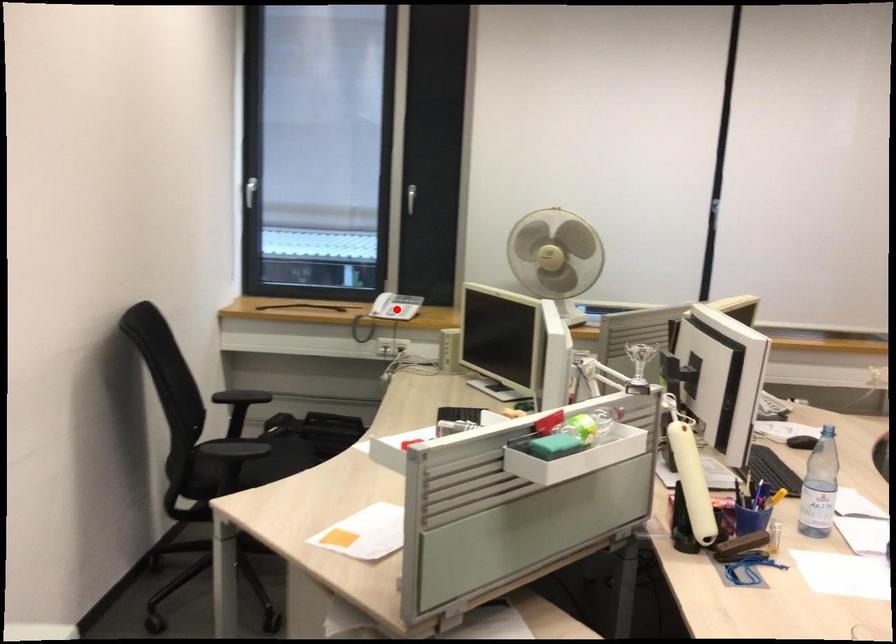
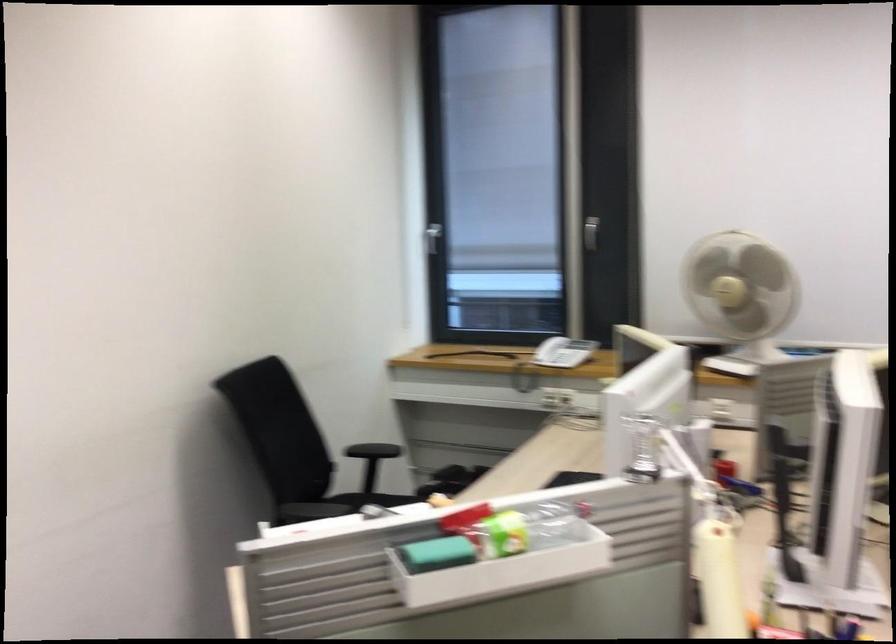
Question: I am providing you with two images of the same scene from different viewpoints. In image1, a red point is highlighted. Considering the same 3D point in image2, which of the following is correct?

Choices:
 (A) It is closer
 (B) It is farther

Answer: (A)